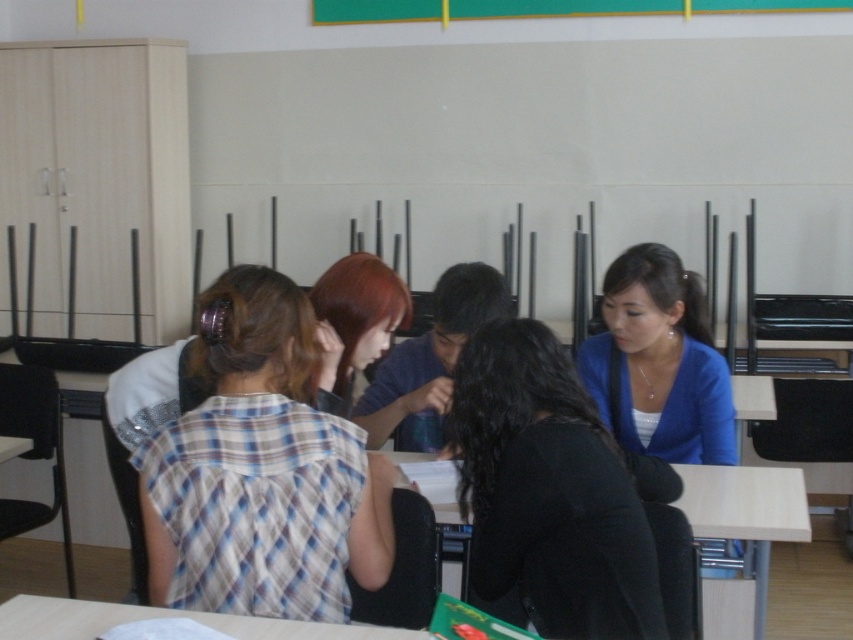
Question: From the image, what is the correct spatial relationship of blue matte cardigan at center in relation to shiny brown hair at center?

Choices:
 (A) right
 (B) left

Answer: (A)

Question: Among these points, which one is nearest to the camera?

Choices:
 (A) (331, 392)
 (B) (367, 10)
 (C) (643, 545)

Answer: (C)

Question: Which object is the farthest from the black matte jacket at center?

Choices:
 (A) green matte board at upper center
 (B) light wood table at center
 (C) wooden table at lower center

Answer: (A)

Question: Does black matte jacket at center have a lesser width compared to wooden table at lower center?

Choices:
 (A) no
 (B) yes

Answer: (B)

Question: Can you confirm if blue matte cardigan at center is positioned below green matte board at upper center?

Choices:
 (A) no
 (B) yes

Answer: (B)

Question: Among these objects, which one is nearest to the camera?

Choices:
 (A) black matte jacket at center
 (B) shiny brown hair at center

Answer: (A)